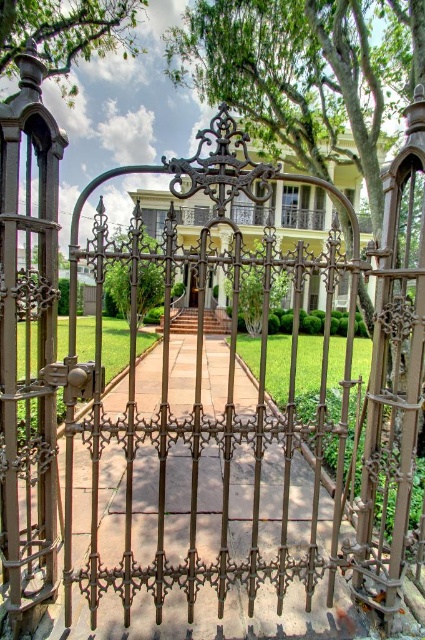
Between green leafy tree at center and matte bronze door at center, which one is positioned higher?

green leafy tree at center is above.

Measure the distance between green leafy tree at center and matte bronze door at center.

green leafy tree at center is 2.97 meters from matte bronze door at center.

From the picture: Who is more forward, (119, 269) or (189, 300)?

Point (119, 269) is more forward.

You are a GUI agent. You are given a task and a screenshot of the screen. Output one action in this format:
    pyautogui.click(x=<x>, y=<y>)
    Task: Click on the green leafy tree at center
    The height and width of the screenshot is (640, 425).
    Given the screenshot: What is the action you would take?
    pyautogui.click(x=147, y=285)

Is green leafy tree at upper left positioned at the back of green leafy tree at center?

That is True.

Looking at this image, does green leafy tree at upper left appear on the left side of green leafy tree at center?

Indeed, green leafy tree at upper left is positioned on the left side of green leafy tree at center.

Does point (135, 1) come in front of point (107, 268)?

Yes, point (135, 1) is in front of point (107, 268).

This screenshot has height=640, width=425. What are the coordinates of `green leafy tree at upper left` in the screenshot? It's located at (65, 33).

Between green leafy tree at upper left and matte bronze door at center, which one has more height?

Standing taller between the two is green leafy tree at upper left.

Which is above, green leafy tree at upper left or matte bronze door at center?

green leafy tree at upper left is higher up.

Which is in front, point (59, 0) or point (189, 298)?

Point (59, 0) is more forward.

Where is `green leafy tree at upper left`? green leafy tree at upper left is located at coordinates (65, 33).